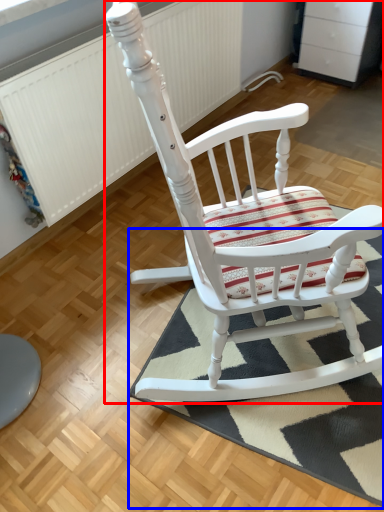
Question: Among these objects, which one is nearest to the camera, chair (highlighted by a red box) or doormat (highlighted by a blue box)?

Choices:
 (A) chair
 (B) doormat

Answer: (A)